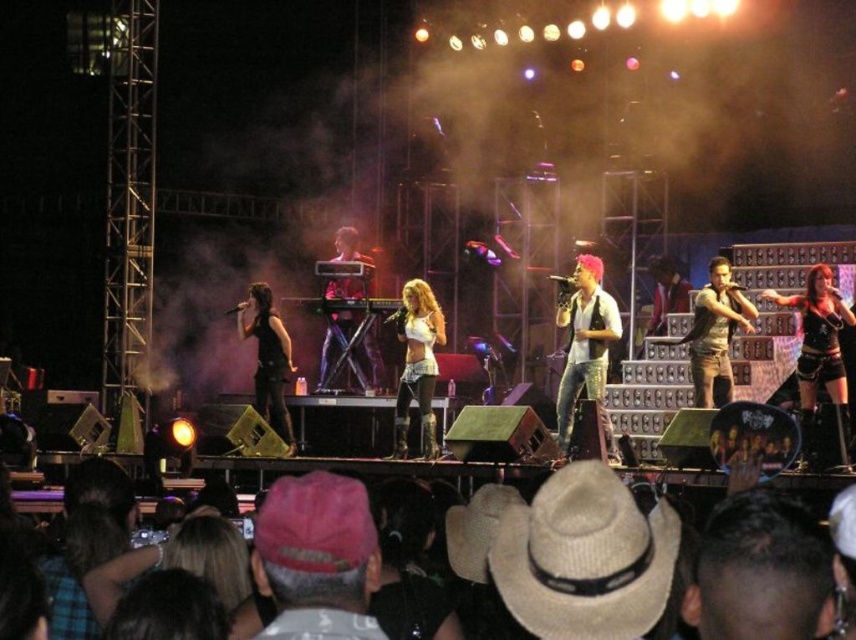
You are a photographer at the concert and want to capture a clear shot of both the white felt cowboy hat at center and the camouflage fabric shirt at center. Considering their positions, which one should you focus on first to ensure it doesn not get obscured?

The white felt cowboy hat at center might be wider than camouflage fabric shirt at center, so you should focus on the white felt cowboy hat at center first to prevent it from obscuring the camouflage fabric shirt at center if they are positioned close to the same plane.

You are a photographer at the concert. You want to capture a photo that includes both the black leather shorts at center and the camouflage fabric shirt at center. Which one should you zoom in on to ensure both are clearly visible in the photo?

The black leather shorts at center is smaller than the camouflage fabric shirt at center, so you should zoom in on the camouflage fabric shirt at center to ensure both items are clearly visible in the photo.

You are a photographer at the concert. You want to take a photo that includes both the pink sequined shirt at center and the white leather boots at center. Can you position yourself in a way that both items are in the same frame without moving either object? Explain your reasoning.

The pink sequined shirt at center and white leather boots at center are 6.68 meters apart. Depending on the camera lens used, a wide angle lens could potentially capture both items in the same frame without moving either object, as they are not excessively far apart.